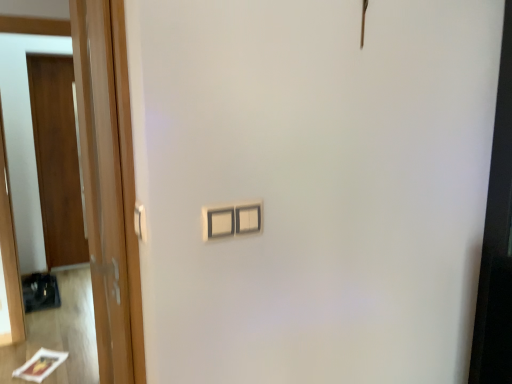
Question: Does white plastic door handle at left have a larger size compared to wooden door at left, which ranks as the second door in left-to-right order?

Choices:
 (A) yes
 (B) no

Answer: (B)

Question: Can you confirm if white plastic door handle at left is taller than wooden door at left, which is counted as the 1th door, starting from the right?

Choices:
 (A) yes
 (B) no

Answer: (B)

Question: Is white plastic door handle at left in front of wooden door at left, which ranks as the second door in left-to-right order?

Choices:
 (A) yes
 (B) no

Answer: (B)

Question: From a real-world perspective, is white plastic door handle at left positioned under wooden door at left, which ranks as the second door in left-to-right order, based on gravity?

Choices:
 (A) yes
 (B) no

Answer: (B)

Question: From a real-world perspective, does white plastic door handle at left stand above wooden door at left, which ranks as the second door in left-to-right order?

Choices:
 (A) no
 (B) yes

Answer: (B)

Question: Is white plastic door handle at left aimed at wooden door at left, acting as the 2th door starting from the back?

Choices:
 (A) no
 (B) yes

Answer: (A)

Question: Does white plastic light switch at center appear on the right side of wooden door at left, which ranks as the second door in left-to-right order?

Choices:
 (A) no
 (B) yes

Answer: (B)

Question: Can we say white plastic light switch at center lies outside wooden door at left, which ranks as the second door in left-to-right order?

Choices:
 (A) yes
 (B) no

Answer: (A)

Question: Does white plastic light switch at center have a lesser width compared to wooden door at left, which is counted as the 1th door, starting from the right?

Choices:
 (A) no
 (B) yes

Answer: (B)

Question: From the image's perspective, would you say white plastic light switch at center is shown under wooden door at left, acting as the 2th door starting from the back?

Choices:
 (A) no
 (B) yes

Answer: (A)

Question: Is white plastic light switch at center at the left side of wooden door at left, acting as the 2th door starting from the back?

Choices:
 (A) no
 (B) yes

Answer: (A)

Question: Is white plastic light switch at center closer to camera compared to wooden door at left, which is counted as the 1th door, starting from the right?

Choices:
 (A) yes
 (B) no

Answer: (B)

Question: Considering the relative sizes of wooden door at left, acting as the 2th door starting from the back, and white plastic light switch at center in the image provided, is wooden door at left, acting as the 2th door starting from the back, wider than white plastic light switch at center?

Choices:
 (A) yes
 (B) no

Answer: (A)